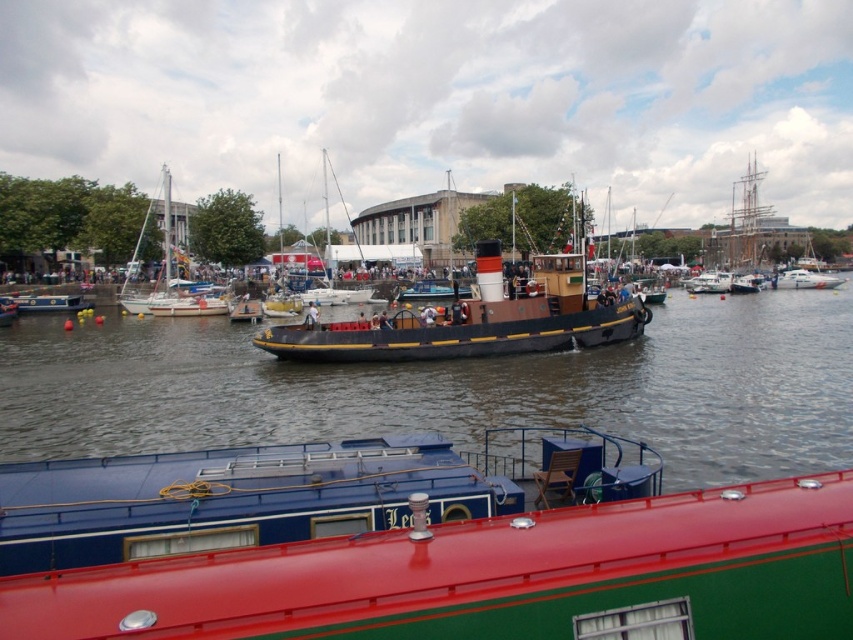
You are a photographer positioned on the dock, aiming to capture a photo of the white sailboat at left and the matte black boat at center. Which boat should you focus on first to ensure it appears in the foreground of your photo?

You should focus on the white sailboat at left first because the matte black boat at center is behind it, making the white sailboat at left closer to the camera and thus the foreground.

You are standing at the point with coordinates (477,320) in the image. What object are you on?

The point (477,320) is on the brown wooden tugboat at center.

You are a photographer positioned on the dock, and you want to capture a photo that includes both the white sailboat at left and the matte black boat at center. Based on their positions, which boat should you focus on first to ensure both are in frame?

The white sailboat at left is above the matte black boat at center, so focusing on the white sailboat at left first would ensure both are in frame as the matte black boat at center is positioned lower.